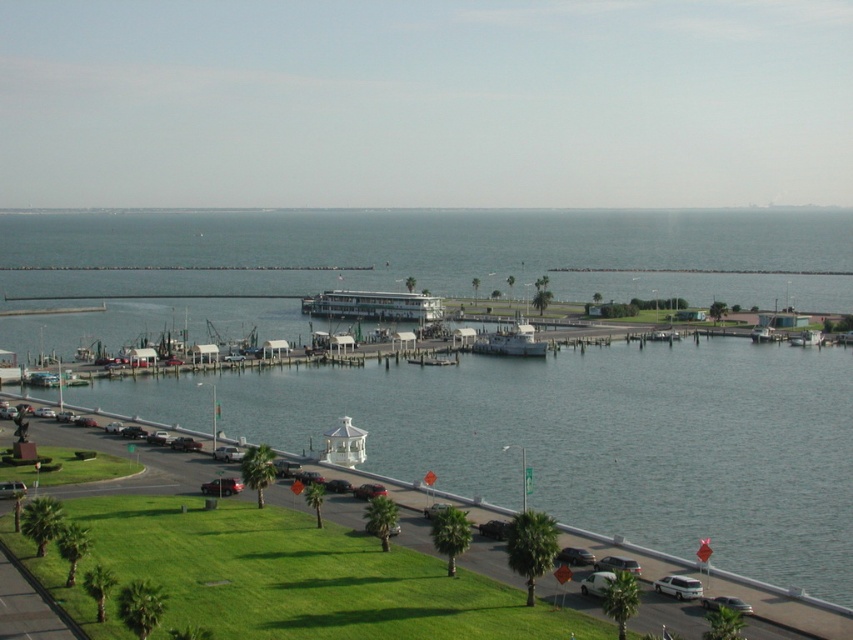
Question: Is white glossy ship at center bigger than white matte sedan at lower right?

Choices:
 (A) no
 (B) yes

Answer: (B)

Question: Where is white glossy ship at center located in relation to metallic silver sedan at lower center in the image?

Choices:
 (A) left
 (B) right

Answer: (B)

Question: Which point is farther to the camera?

Choices:
 (A) (198, 221)
 (B) (720, 604)
 (C) (692, 593)
 (D) (323, 307)

Answer: (A)

Question: Which object is farther from the camera taking this photo?

Choices:
 (A) white glossy ship at center
 (B) white matte sedan at lower right
 (C) metallic silver sedan at center
 (D) white glossy cruise ship at center

Answer: (D)

Question: Is metallic silver sedan at lower center to the right of metallic silver sedan at center from the viewer's perspective?

Choices:
 (A) no
 (B) yes

Answer: (A)

Question: Which object is closer to the camera taking this photo?

Choices:
 (A) clear blue water at center
 (B) white glossy cruise ship at center
 (C) metallic silver sedan at lower right
 (D) metallic silver sedan at center

Answer: (C)